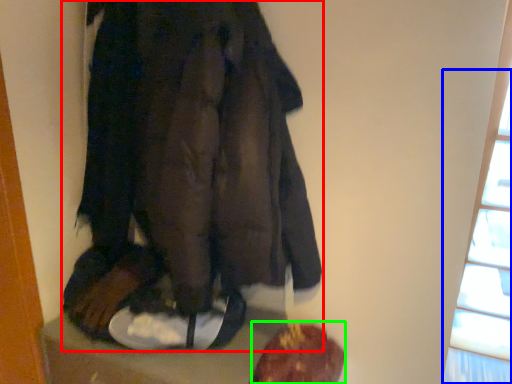
Question: Considering the real-world distances, which object is farthest from fancy dress (highlighted by a red box)? window (highlighted by a blue box) or food (highlighted by a green box)?

Choices:
 (A) window
 (B) food

Answer: (A)